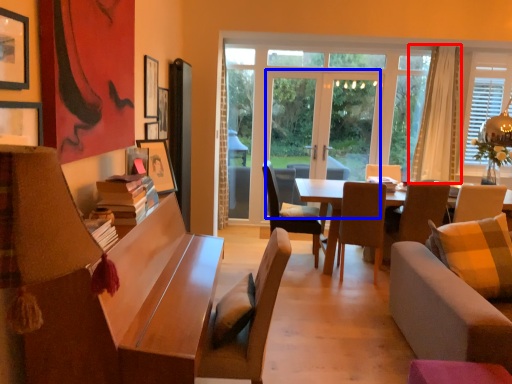
Question: Which object appears farthest to the camera in this image, curtain (highlighted by a red box) or screen door (highlighted by a blue box)?

Choices:
 (A) curtain
 (B) screen door

Answer: (B)